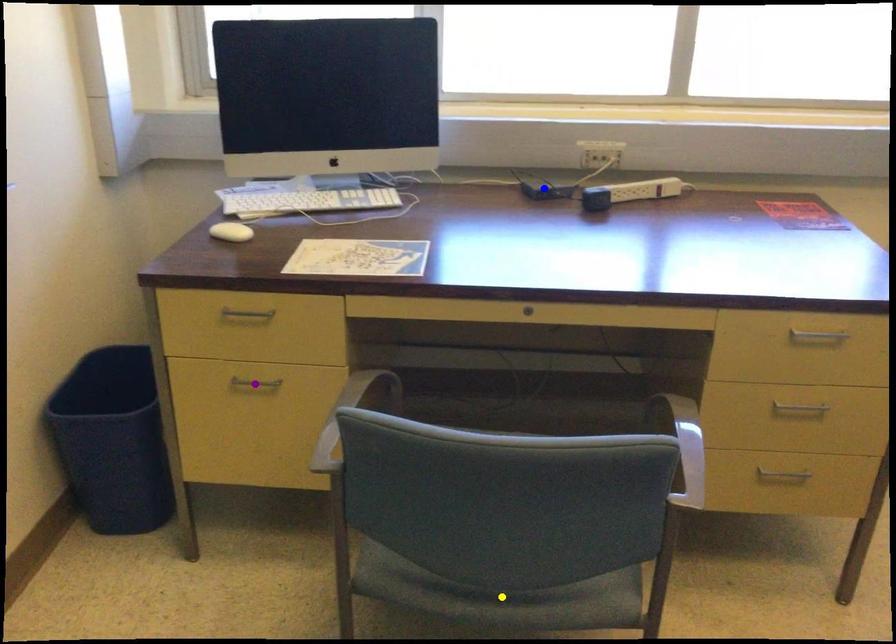
Order these from nearest to farthest:
purple point
yellow point
blue point

1. yellow point
2. purple point
3. blue point